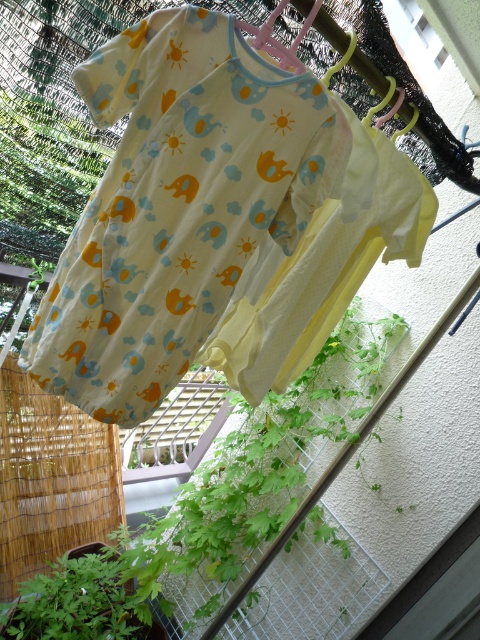
Between matte yellow fabric baby clothes at center and green leafy plant at center, which one appears on the left side from the viewer's perspective?

From the viewer's perspective, matte yellow fabric baby clothes at center appears more on the left side.

Who is more forward, (140, 156) or (267, 456)?

Point (140, 156) is more forward.

Between point (182, 22) and point (279, 403), which one is positioned behind?

The point (279, 403) is more distant.

Find the location of a particular element. The height and width of the screenshot is (640, 480). matte yellow fabric baby clothes at center is located at coordinates (180, 202).

Who is more forward, [165,589] or [106,605]?

Positioned in front is point [106,605].

Locate an element on the screen. This screenshot has height=640, width=480. green leafy plant at center is located at coordinates pos(262,472).

The image size is (480, 640). I want to click on green leafy plant at center, so click(x=262, y=472).

Is matte yellow fabric baby clothes at center smaller than green leafy plant at lower left?

No, matte yellow fabric baby clothes at center is not smaller than green leafy plant at lower left.

Between point (181, 90) and point (51, 605), which one is positioned behind?

Positioned behind is point (51, 605).

Where is `matte yellow fabric baby clothes at center`? The height and width of the screenshot is (640, 480). matte yellow fabric baby clothes at center is located at coordinates (180, 202).